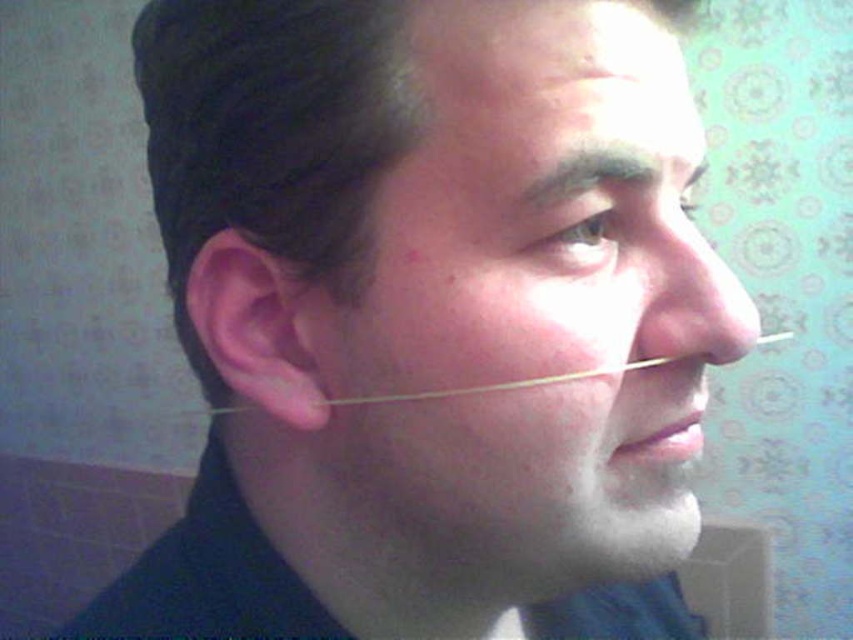
Question: Is dark brown hair at upper center wider than clear plastic tube at nose?

Choices:
 (A) yes
 (B) no

Answer: (B)

Question: Which object is the closest to the smooth skin face at center?

Choices:
 (A) dark brown hair at upper center
 (B) clear plastic tube at nose

Answer: (B)

Question: Which of the following is the farthest from the observer?

Choices:
 (A) (490, 122)
 (B) (612, 170)

Answer: (B)

Question: Can you confirm if smooth skin face at center is wider than clear plastic tube at nose?

Choices:
 (A) no
 (B) yes

Answer: (A)

Question: Estimate the real-world distances between objects in this image. Which object is farther from the clear plastic tube at nose?

Choices:
 (A) dark brown hair at upper center
 (B) smooth skin face at center

Answer: (A)

Question: Is smooth skin face at center thinner than dark brown hair at upper center?

Choices:
 (A) yes
 (B) no

Answer: (B)